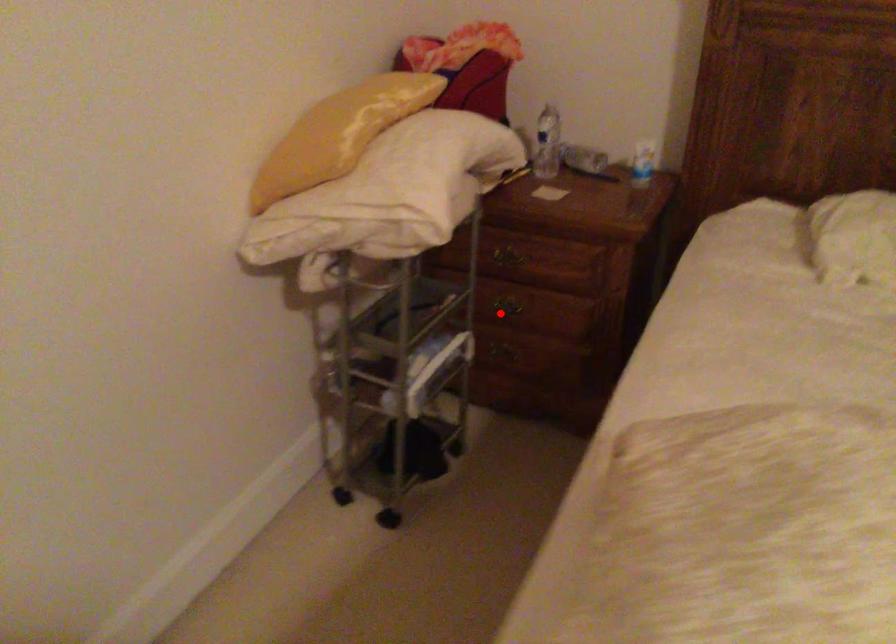
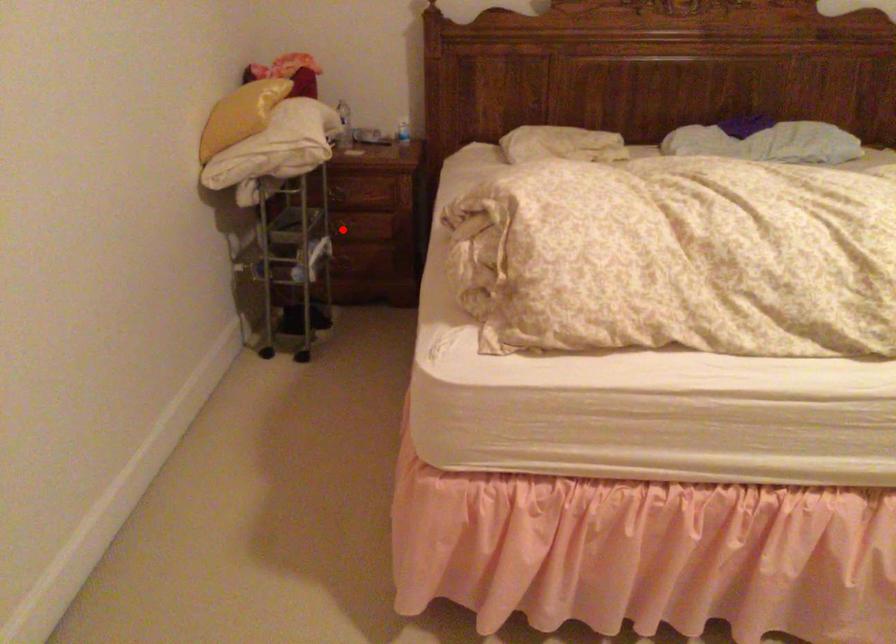
I am providing you with two images of the same scene from different viewpoints. A red point is marked on the first image and another point is marked on the second image. Is the marked point in image1 the same physical position as the marked point in image2?

Yes